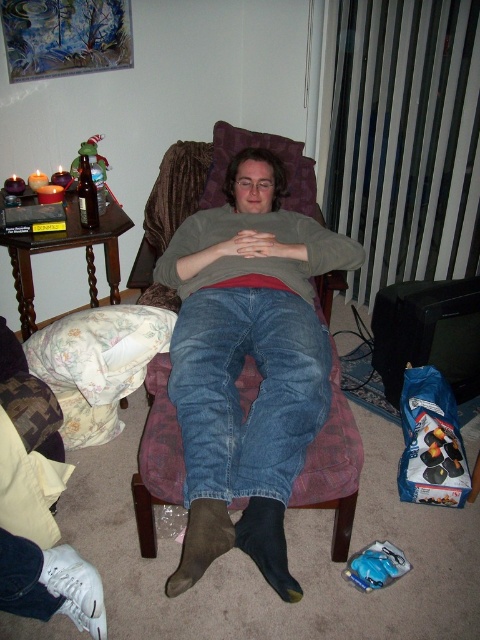
Question: Considering the relative positions of denim jeans at center and purple fabric armchair at center in the image provided, where is denim jeans at center located with respect to purple fabric armchair at center?

Choices:
 (A) right
 (B) left

Answer: (B)

Question: Is denim jeans at center bigger than purple fabric armchair at center?

Choices:
 (A) yes
 (B) no

Answer: (B)

Question: Can you confirm if denim jeans at center is positioned below purple fabric armchair at center?

Choices:
 (A) no
 (B) yes

Answer: (A)

Question: Which point is closer to the camera?

Choices:
 (A) (192, 349)
 (B) (163, 204)

Answer: (A)